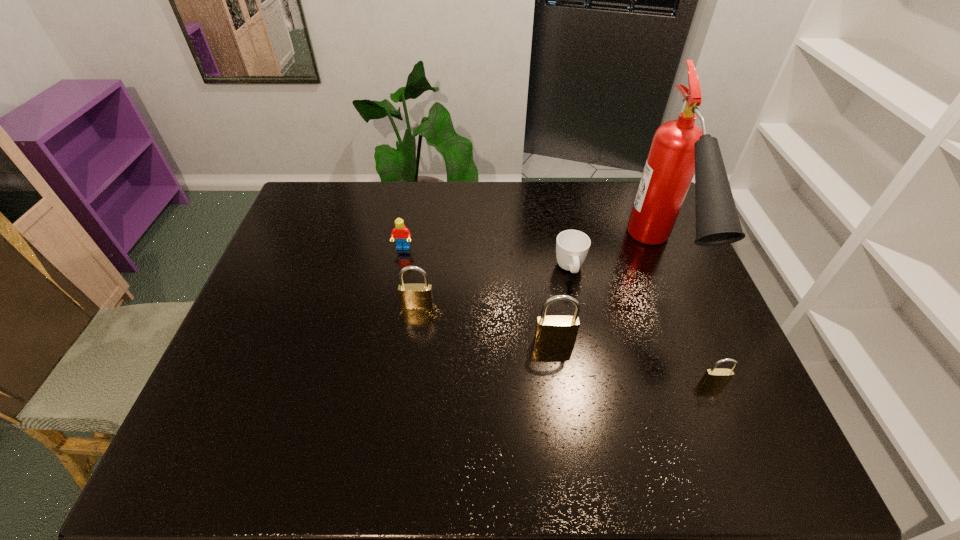
Please show where to add a padlock on the left while keeping spacing even. Please provide its 2D coordinates. Your answer should be formatted as a tuple, i.e. [(x, y)], where the tuple contains the x and y coordinates of a point satisfying the conditions above.

[(299, 274)]